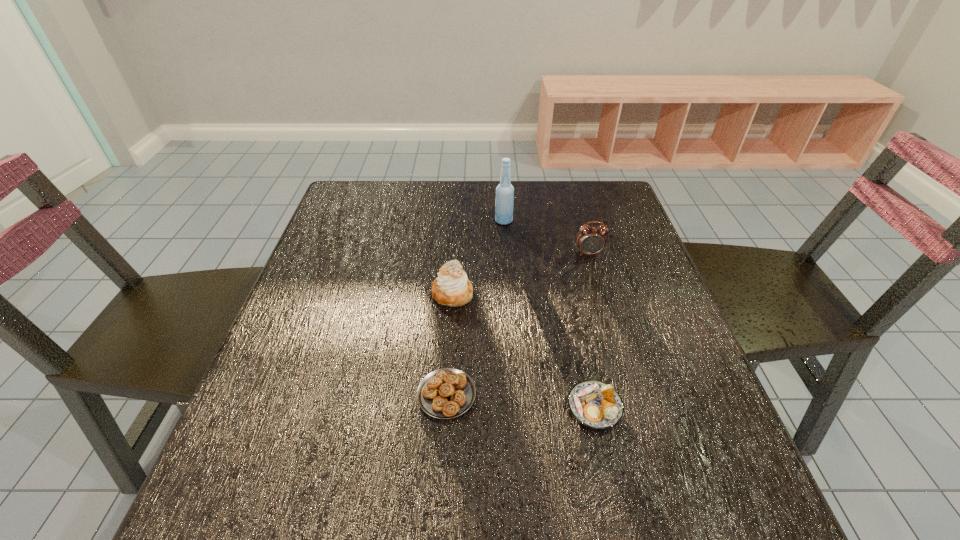
Identify the location of blank space located on the left of the rightmost pastry. (376, 407).

You are a GUI agent. You are given a task and a screenshot of the screen. Output one action in this format:
    pyautogui.click(x=<x>, y=<y>)
    Task: Click on the vacant space situated on the right of the shortest pastry
    The width and height of the screenshot is (960, 540).
    Given the screenshot: What is the action you would take?
    pyautogui.click(x=508, y=394)

What are the coordinates of `object at the far edge` in the screenshot? It's located at (504, 202).

Where is `object located in the right edge section of the desktop`? The height and width of the screenshot is (540, 960). object located in the right edge section of the desktop is located at coordinates (590, 240).

Locate an element on the screen. The height and width of the screenshot is (540, 960). free spot at the far edge of the desktop is located at coordinates (487, 221).

The image size is (960, 540). I want to click on free space at the near edge of the desktop, so click(x=537, y=509).

In the image, there is a desktop. Where is `free space at the left edge`? The height and width of the screenshot is (540, 960). free space at the left edge is located at coordinates (300, 424).

The width and height of the screenshot is (960, 540). In the image, there is a desktop. Find the location of `free space at the right edge`. free space at the right edge is located at coordinates (631, 347).

The image size is (960, 540). What are the coordinates of `vacant space at the far left corner` in the screenshot? It's located at (376, 204).

I want to click on vacant region at the far right corner of the desktop, so click(x=607, y=213).